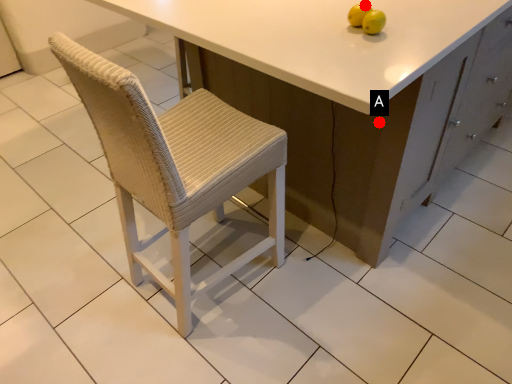
Question: Two points are circled on the image, labeled by A and B beside each circle. Which point appears closest to the camera in this image?

Choices:
 (A) A is closer
 (B) B is closer

Answer: (B)